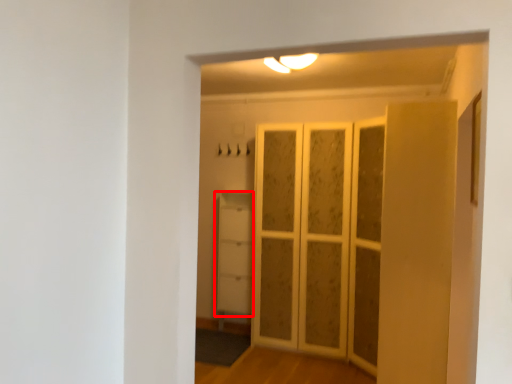
Question: In this image, where is cupboard (annotated by the red box) located relative to screen door?

Choices:
 (A) right
 (B) left

Answer: (B)